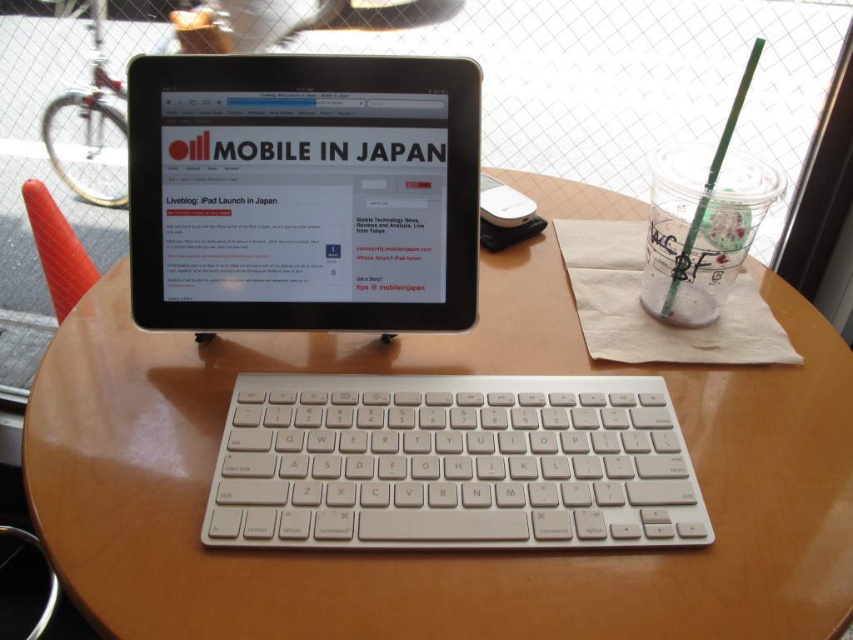
Question: Can you confirm if wooden table at center is wider than black glossy tablet at center?

Choices:
 (A) no
 (B) yes

Answer: (B)

Question: Can you confirm if wooden table at center is positioned below black glossy tablet at center?

Choices:
 (A) no
 (B) yes

Answer: (B)

Question: Which object appears closest to the camera in this image?

Choices:
 (A) white plastic keyboard at center
 (B) wooden table at center

Answer: (B)

Question: Based on their relative distances, which object is farther from the white plastic keyboard at center?

Choices:
 (A) wooden table at center
 (B) black glossy tablet at center

Answer: (B)

Question: Which point is closer to the camera taking this photo?

Choices:
 (A) (445, 438)
 (B) (381, 577)
 (C) (178, 314)

Answer: (B)

Question: Can you confirm if wooden table at center is thinner than white plastic keyboard at center?

Choices:
 (A) yes
 (B) no

Answer: (B)